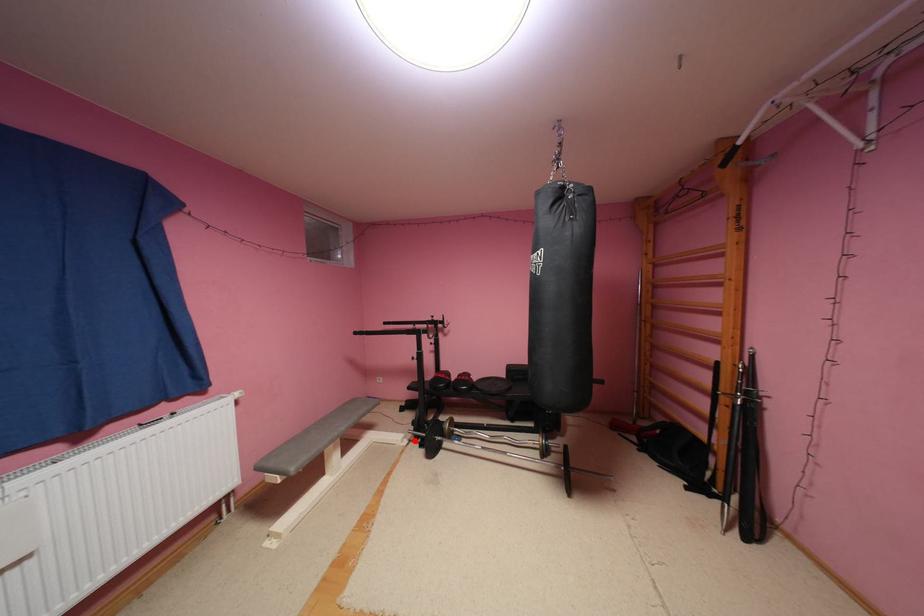
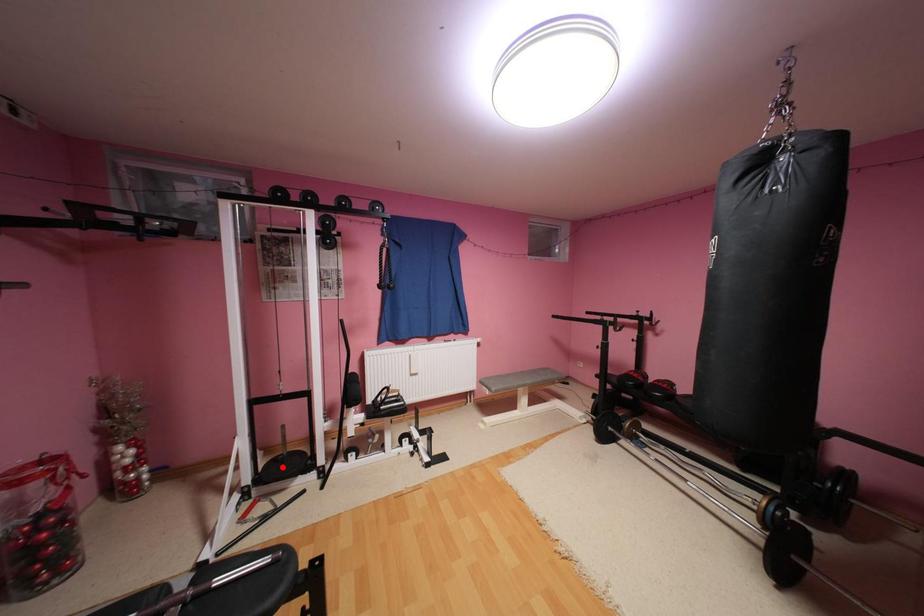
I am providing you with two images of the same scene from different viewpoints. A red point is marked on the first image and another point is marked on the second image. Do the highlighted points in image1 and image2 indicate the same real-world spot?

No